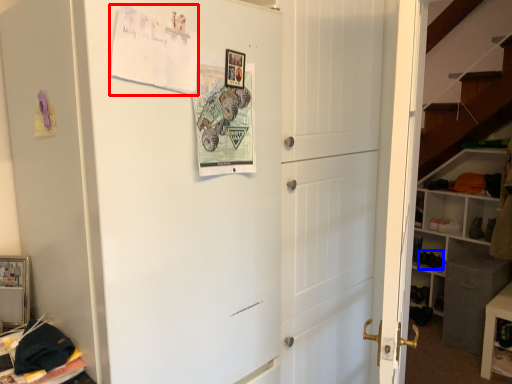
Question: Which of the following is the closest to the observer, postcard (highlighted by a red box) or shoe (highlighted by a blue box)?

Choices:
 (A) postcard
 (B) shoe

Answer: (A)